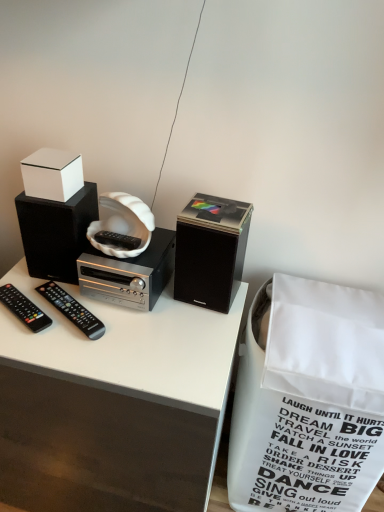
Question: Is white paper shopping bag at lower right aimed at black plastic remote at lower left, the 1th remote control viewed from the right?

Choices:
 (A) no
 (B) yes

Answer: (A)

Question: From a real-world perspective, is white paper shopping bag at lower right under black plastic remote at lower left, which is counted as the 2th remote control, starting from the left?

Choices:
 (A) no
 (B) yes

Answer: (B)

Question: Considering the relative positions of white paper shopping bag at lower right and black plastic remote at lower left, the 1th remote control viewed from the right, in the image provided, is white paper shopping bag at lower right to the right of black plastic remote at lower left, the 1th remote control viewed from the right, from the viewer's perspective?

Choices:
 (A) no
 (B) yes

Answer: (B)

Question: Is white paper shopping bag at lower right positioned behind black plastic remote at lower left, the 1th remote control viewed from the right?

Choices:
 (A) yes
 (B) no

Answer: (B)

Question: Considering the relative sizes of white paper shopping bag at lower right and black plastic remote at lower left, the 1th remote control viewed from the right, in the image provided, is white paper shopping bag at lower right thinner than black plastic remote at lower left, the 1th remote control viewed from the right,?

Choices:
 (A) yes
 (B) no

Answer: (B)

Question: From a real-world perspective, is white paper shopping bag at lower right on top of black plastic remote at lower left, the 1th remote control viewed from the right?

Choices:
 (A) yes
 (B) no

Answer: (B)

Question: Does white glossy box at upper left lie behind black plastic remote at left, which ranks as the 1th remote control in left-to-right order?

Choices:
 (A) no
 (B) yes

Answer: (B)

Question: Is white glossy box at upper left not inside black plastic remote at left, marked as the second remote control in a right-to-left arrangement?

Choices:
 (A) no
 (B) yes

Answer: (B)

Question: Considering the relative positions of white glossy box at upper left and black plastic remote at left, which ranks as the 1th remote control in left-to-right order, in the image provided, is white glossy box at upper left in front of black plastic remote at left, which ranks as the 1th remote control in left-to-right order,?

Choices:
 (A) no
 (B) yes

Answer: (A)

Question: From the image's perspective, is white glossy box at upper left on black plastic remote at left, which ranks as the 1th remote control in left-to-right order?

Choices:
 (A) no
 (B) yes

Answer: (B)

Question: Can you confirm if white glossy box at upper left is bigger than black plastic remote at left, which ranks as the 1th remote control in left-to-right order?

Choices:
 (A) no
 (B) yes

Answer: (B)

Question: Is white glossy box at upper left aimed at black plastic remote at left, marked as the second remote control in a right-to-left arrangement?

Choices:
 (A) no
 (B) yes

Answer: (A)

Question: Does white glossy box at upper left come behind black plastic remote at lower left, the 1th remote control viewed from the right?

Choices:
 (A) yes
 (B) no

Answer: (A)